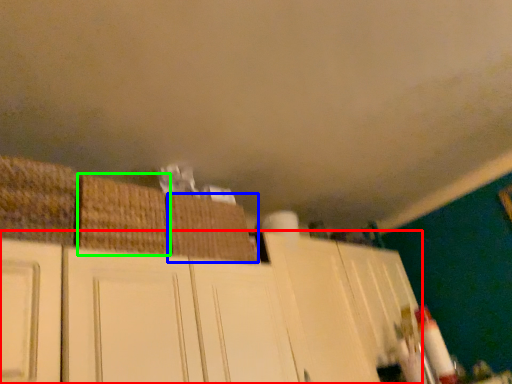
Question: Which is farther away from cabinetry (highlighted by a red box)? basket (highlighted by a blue box) or basket (highlighted by a green box)?

Choices:
 (A) basket
 (B) basket

Answer: (B)